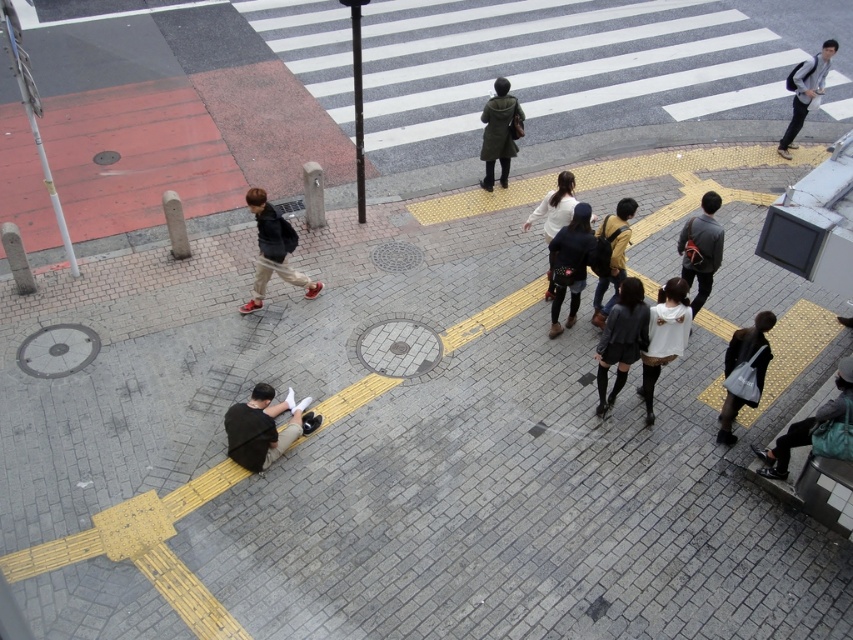
Question: Which point is farther to the camera?

Choices:
 (A) white matte jacket at center
 (B) yellow fabric jacket at center
 (C) green matte coat at center

Answer: (C)

Question: Which point is farther from the camera taking this photo?

Choices:
 (A) click(554, 273)
 (B) click(846, 387)

Answer: (A)

Question: Is white matte jacket at lower right smaller than light gray backpack at upper right?

Choices:
 (A) yes
 (B) no

Answer: (A)

Question: Can you confirm if matte black skateboard at center is positioned to the left of yellow fabric jacket at center?

Choices:
 (A) no
 (B) yes

Answer: (B)

Question: Does dark gray pants at lower left appear over dark gray jacket at right?

Choices:
 (A) no
 (B) yes

Answer: (A)

Question: Which of the following is the farthest from the observer?

Choices:
 (A) matte black bag at lower right
 (B) green matte coat at center

Answer: (B)